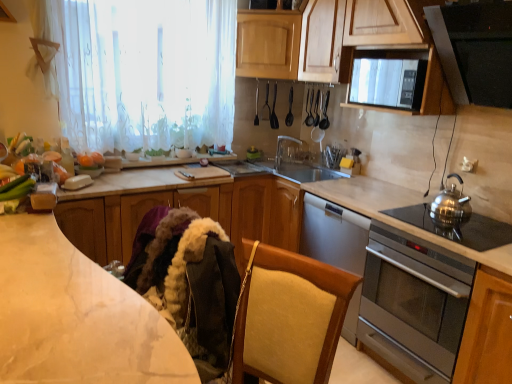
Identify the location of empty space that is ontop of stainless steel oven at right. This screenshot has height=384, width=512. (457, 225).